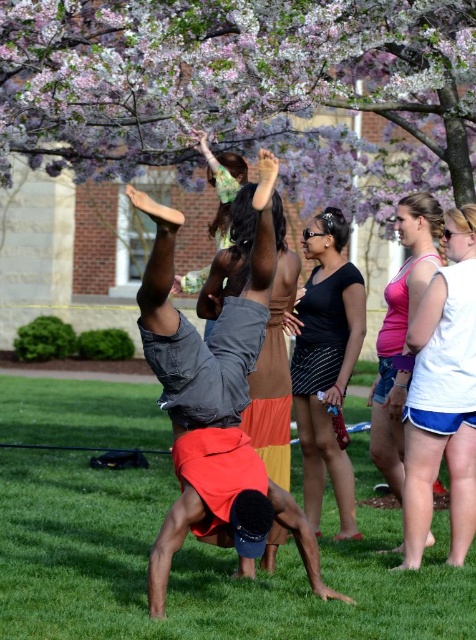
You are standing in the grassy area under the cherry blossom trees and want to walk from point A to point B. Point A is at coordinate point (175,428) and point B is at coordinate point (327,221). Since you want to take the shortest path, which point should you start walking from?

You should start walking from point A at coordinate point (175,428) because it is closer to you than point B at coordinate point (327,221). Since you want the shortest path, starting from the closer point would be more efficient.

You are a photographer standing at the edge of the grassy area. You want to capture a photo that includes both the denim shorts at center and the black striped skirt at center. What is the minimum distance you need to move backward to ensure both objects are fully visible in your frame?

The denim shorts at center and the black striped skirt at center are 5.43 feet apart. To capture both in the frame, you need to move back at least 5.43 feet to ensure they are fully visible.

You are an artist planning to paint the scene. You want to emphasize the purple blossoms at upper center and green grass at center. Which object should you paint larger to show their relative sizes as seen in the image?

The purple blossoms at upper center should be painted larger than the green grass at center because they are described as having a larger size compared to the green grass at center.